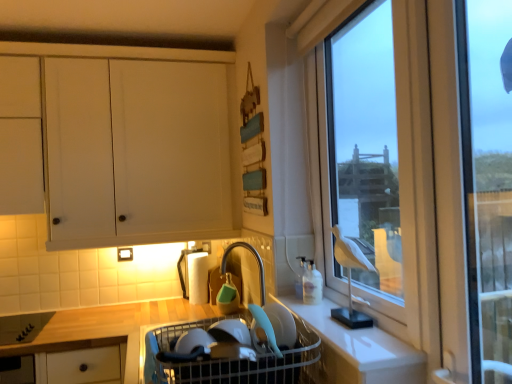
Question: From the image's perspective, is white plastic sink at center located above white matte cabinet at upper left?

Choices:
 (A) yes
 (B) no

Answer: (B)

Question: Does white plastic sink at center appear on the right side of white matte cabinet at upper left?

Choices:
 (A) no
 (B) yes

Answer: (B)

Question: Does white plastic sink at center have a lesser height compared to white matte cabinet at upper left?

Choices:
 (A) no
 (B) yes

Answer: (B)

Question: Is white plastic sink at center far away from white matte cabinet at upper left?

Choices:
 (A) no
 (B) yes

Answer: (B)

Question: Is white plastic sink at center in front of white matte cabinet at upper left?

Choices:
 (A) yes
 (B) no

Answer: (A)

Question: From the image's perspective, is white plastic sink at center located beneath white matte cabinet at upper left?

Choices:
 (A) no
 (B) yes

Answer: (B)

Question: Is the depth of white plastic sink at center greater than that of white matte counter at lower right?

Choices:
 (A) no
 (B) yes

Answer: (B)

Question: From a real-world perspective, does white plastic sink at center stand above white matte counter at lower right?

Choices:
 (A) yes
 (B) no

Answer: (B)

Question: Is white plastic sink at center closer to the viewer compared to white matte counter at lower right?

Choices:
 (A) no
 (B) yes

Answer: (A)

Question: Considering the relative sizes of white plastic sink at center and white matte counter at lower right in the image provided, is white plastic sink at center smaller than white matte counter at lower right?

Choices:
 (A) yes
 (B) no

Answer: (B)

Question: Is white plastic sink at center oriented towards white matte counter at lower right?

Choices:
 (A) no
 (B) yes

Answer: (A)

Question: Does white plastic sink at center have a greater height compared to white matte counter at lower right?

Choices:
 (A) no
 (B) yes

Answer: (B)

Question: Is white plastic sink at center looking in the opposite direction of transparent glass window at right?

Choices:
 (A) yes
 (B) no

Answer: (B)